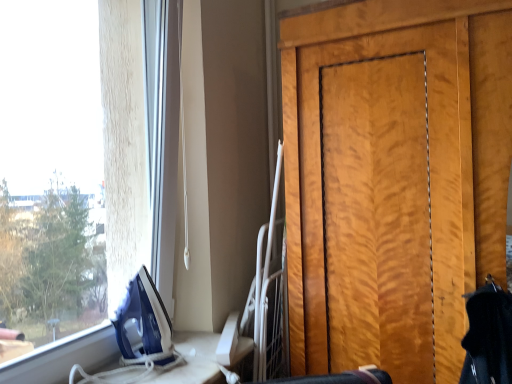
The image size is (512, 384). Describe the element at coordinates (405, 167) in the screenshot. I see `wooden door at right` at that location.

Find the location of a particular element. This screenshot has width=512, height=384. wooden door at right is located at coordinates (405, 167).

Describe the element at coordinates (172, 365) in the screenshot. I see `white plastic table at lower left` at that location.

You are a GUI agent. You are given a task and a screenshot of the screen. Output one action in this format:
    pyautogui.click(x=<x>, y=<y>)
    Task: Click on the white plastic table at lower left
    The height and width of the screenshot is (384, 512).
    Given the screenshot: What is the action you would take?
    pyautogui.click(x=172, y=365)

Find the location of a particular element. The image size is (512, 384). wooden door at right is located at coordinates (405, 167).

Which object is positioned more to the left, wooden door at right or white plastic table at lower left?

Positioned to the left is white plastic table at lower left.

Does wooden door at right lie in front of white plastic table at lower left?

No, wooden door at right is behind white plastic table at lower left.

Does point (295, 100) come farther from viewer compared to point (247, 337)?

No, (295, 100) is in front of (247, 337).

From the image's perspective, would you say wooden door at right is positioned over white plastic table at lower left?

Indeed, from the image's perspective, wooden door at right is shown above white plastic table at lower left.

From a real-world perspective, is wooden door at right physically above white plastic table at lower left?

Yes, from a real-world perspective, wooden door at right is above white plastic table at lower left.

Can you confirm if wooden door at right is thinner than white plastic table at lower left?

No.

Who is taller, wooden door at right or white plastic table at lower left?

wooden door at right is taller.

Considering the sizes of objects wooden door at right and white plastic table at lower left in the image provided, who is smaller, wooden door at right or white plastic table at lower left?

white plastic table at lower left.

Would you say wooden door at right contains white plastic table at lower left?

Definitely not — white plastic table at lower left is not inside wooden door at right.

From the picture: Can you see wooden door at right touching white plastic table at lower left?

No.

Is white plastic table at lower left at the back of wooden door at right?

No, wooden door at right's orientation is not away from white plastic table at lower left.

You are a GUI agent. You are given a task and a screenshot of the screen. Output one action in this format:
    pyautogui.click(x=<x>, y=<y>)
    Task: Click on the door behind the white plastic table at lower left
    
    Given the screenshot: What is the action you would take?
    pyautogui.click(x=405, y=167)

Which is more to the left, white plastic table at lower left or wooden door at right?

Positioned to the left is white plastic table at lower left.

Is white plastic table at lower left in front of wooden door at right?

Yes, white plastic table at lower left is closer to the camera.

Which is behind, point (112, 369) or point (367, 38)?

The point (367, 38) is farther from the camera.

From the image's perspective, which is above, white plastic table at lower left or wooden door at right?

wooden door at right is shown above in the image.

From a real-world perspective, which object rests below the other?

white plastic table at lower left, from a real-world perspective.

Is white plastic table at lower left wider than wooden door at right?

Incorrect, the width of white plastic table at lower left does not surpass that of wooden door at right.

Is white plastic table at lower left shorter than wooden door at right?

Yes, white plastic table at lower left is shorter than wooden door at right.

Does white plastic table at lower left have a smaller size compared to wooden door at right?

Indeed, white plastic table at lower left has a smaller size compared to wooden door at right.

Would you say white plastic table at lower left is inside or outside wooden door at right?

white plastic table at lower left lies outside wooden door at right.

Would you consider white plastic table at lower left to be distant from wooden door at right?

No, white plastic table at lower left is not far from wooden door at right.

Is wooden door at right at the back of white plastic table at lower left?

No, white plastic table at lower left's orientation is not away from wooden door at right.

How different are the orientations of white plastic table at lower left and wooden door at right in degrees?

91.2 degrees separate the facing orientations of white plastic table at lower left and wooden door at right.

Measure the distance from white plastic table at lower left to wooden door at right.

white plastic table at lower left and wooden door at right are 26.12 inches apart from each other.

Where is `door above the white plastic table at lower left (from a real-world perspective)`? The width and height of the screenshot is (512, 384). door above the white plastic table at lower left (from a real-world perspective) is located at coordinates (405, 167).

The height and width of the screenshot is (384, 512). I want to click on door that appears behind the white plastic table at lower left, so click(x=405, y=167).

Locate an element on the screen. table lying on the left of wooden door at right is located at coordinates (172, 365).